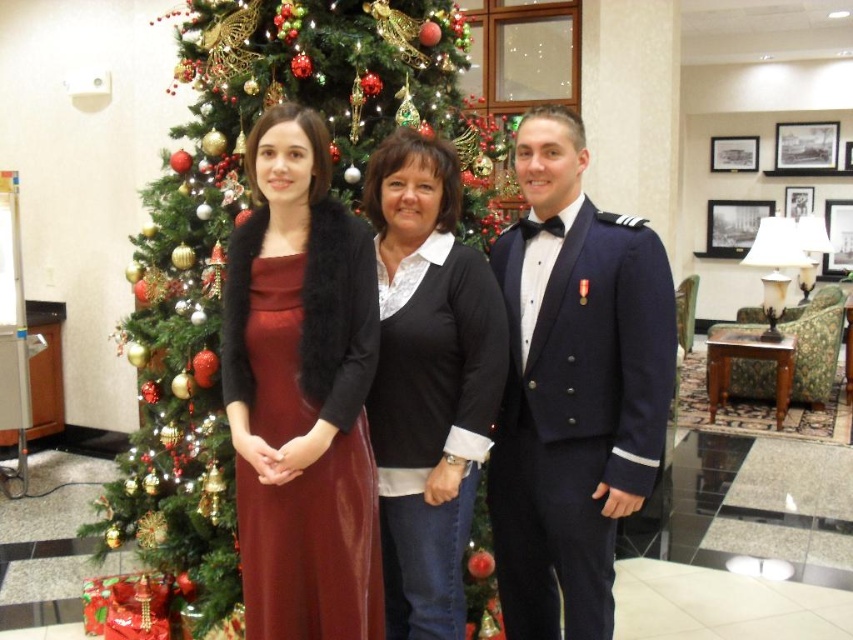
Does matte black dress at center have a greater width compared to velvet burgundy dress at left?

Yes, matte black dress at center is wider than velvet burgundy dress at left.

Identify the location of matte black dress at center. (570, 385).

What do you see at coordinates (570, 385) in the screenshot? The image size is (853, 640). I see `matte black dress at center` at bounding box center [570, 385].

You are a GUI agent. You are given a task and a screenshot of the screen. Output one action in this format:
    pyautogui.click(x=<x>, y=<y>)
    Task: Click on the matte black dress at center
    Image resolution: width=853 pixels, height=640 pixels.
    Given the screenshot: What is the action you would take?
    pyautogui.click(x=570, y=385)

Does navy blue uniform at center come in front of velvet burgundy dress at left?

That is False.

Between point (633, 499) and point (229, 378), which one is positioned behind?

The point (229, 378) is more distant.

Where is `navy blue uniform at center`? navy blue uniform at center is located at coordinates (573, 387).

Is the position of matte black dress at center more distant than that of decorated christmas tree at center?

No, it is in front of decorated christmas tree at center.

Which is more to the right, matte black dress at center or decorated christmas tree at center?

matte black dress at center

Is point (521, 628) positioned behind point (189, 3)?

No.

Locate an element on the screen. This screenshot has height=640, width=853. matte black dress at center is located at coordinates (570, 385).